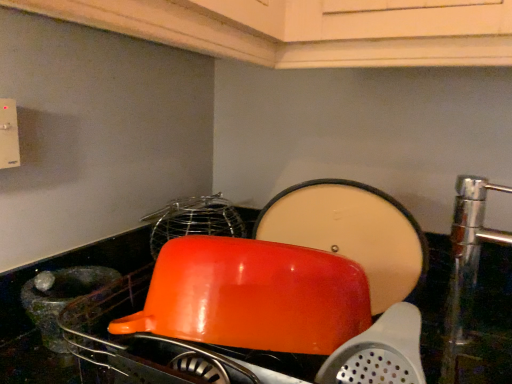
This screenshot has height=384, width=512. What do you see at coordinates (33, 325) in the screenshot? I see `glossy plastic bowl at center` at bounding box center [33, 325].

At what (x,y) coordinates should I click in order to perform the action: click on glossy orange bowl at center. Please return your answer as a coordinate pair (x, y). The height and width of the screenshot is (384, 512). Looking at the image, I should click on (252, 296).

From a real-world perspective, is glossy orange bowl at center on glossy plastic bowl at center?

Yes, from a real-world perspective, glossy orange bowl at center is over glossy plastic bowl at center

Considering the sizes of glossy orange bowl at center and glossy plastic bowl at center in the image, is glossy orange bowl at center wider or thinner than glossy plastic bowl at center?

In the image, glossy orange bowl at center appears to be more narrow than glossy plastic bowl at center.

In the scene shown: Would you consider glossy orange bowl at center to be distant from glossy plastic bowl at center?

Answer: They are positioned close to each other.

Where is `counter top located on the right of glossy orange bowl at center`? The width and height of the screenshot is (512, 384). counter top located on the right of glossy orange bowl at center is located at coordinates (33, 325).

Is translucent glass mortar at left aimed at glossy orange bowl at center?

Yes, translucent glass mortar at left is facing glossy orange bowl at center.

Considering the relative sizes of translucent glass mortar at left and glossy orange bowl at center in the image provided, is translucent glass mortar at left smaller than glossy orange bowl at center?

Yes, translucent glass mortar at left is smaller than glossy orange bowl at center.

Does translucent glass mortar at left have a greater height compared to glossy orange bowl at center?

No.

Does point (46, 292) appear closer or farther from the camera than point (237, 251)?

Point (46, 292) is positioned farther from the camera compared to point (237, 251).

Is translucent glass mortar at left smaller than glossy plastic bowl at center?

Yes, translucent glass mortar at left is smaller than glossy plastic bowl at center.

Which is more distant, (58, 270) or (62, 379)?

The point (58, 270) is behind.

From a real-world perspective, between translucent glass mortar at left and glossy plastic bowl at center, who is vertically higher?

glossy plastic bowl at center, from a real-world perspective.

From the picture: Does glossy plastic bowl at center have a lesser width compared to translucent glass mortar at left?

No.

Who is smaller, glossy plastic bowl at center or translucent glass mortar at left?

translucent glass mortar at left is smaller.

Is glossy plastic bowl at center to the right of translucent glass mortar at left from the viewer's perspective?

Yes, glossy plastic bowl at center is to the right of translucent glass mortar at left.

In the image, there is a glossy plastic bowl at center. Where is `appliance below it (from the image's perspective)`? This screenshot has width=512, height=384. appliance below it (from the image's perspective) is located at coordinates (60, 297).

Looking at this image, is glossy orange bowl at center thinner than translucent glass mortar at left?

In fact, glossy orange bowl at center might be wider than translucent glass mortar at left.

Considering the relative sizes of glossy orange bowl at center and translucent glass mortar at left in the image provided, is glossy orange bowl at center smaller than translucent glass mortar at left?

No, glossy orange bowl at center is not smaller than translucent glass mortar at left.

Which object is positioned more to the right, glossy orange bowl at center or translucent glass mortar at left?

Positioned to the right is glossy orange bowl at center.

Considering the relative sizes of glossy plastic bowl at center and glossy orange bowl at center in the image provided, is glossy plastic bowl at center wider than glossy orange bowl at center?

Yes.

Is the surface of glossy plastic bowl at center in direct contact with glossy orange bowl at center?

No, glossy plastic bowl at center is not with glossy orange bowl at center.

Which point is more distant from viewer, (x=7, y=356) or (x=275, y=303)?

The point (x=7, y=356) is behind.

Is glossy plastic bowl at center not inside glossy orange bowl at center?

Yes, glossy plastic bowl at center is outside of glossy orange bowl at center.

You are a GUI agent. You are given a task and a screenshot of the screen. Output one action in this format:
    pyautogui.click(x=<x>, y=<y>)
    Task: Click on the counter top on the right of the glossy orange bowl at center
    
    Given the screenshot: What is the action you would take?
    pyautogui.click(x=33, y=325)

Where is `appliance below the glossy orange bowl at center (from a real-world perspective)`? The image size is (512, 384). appliance below the glossy orange bowl at center (from a real-world perspective) is located at coordinates (60, 297).

Considering their positions, is glossy orange bowl at center positioned closer to glossy plastic bowl at center than translucent glass mortar at left?

Among the two, translucent glass mortar at left is located nearer to glossy plastic bowl at center.

Looking at the image, which one is located closer to glossy orange bowl at center, glossy plastic bowl at center or translucent glass mortar at left?

translucent glass mortar at left is closer to glossy orange bowl at center.

Which object lies nearer to the anchor point glossy plastic bowl at center, translucent glass mortar at left or glossy orange bowl at center?

Among the two, translucent glass mortar at left is located nearer to glossy plastic bowl at center.

When comparing their distances from translucent glass mortar at left, does glossy plastic bowl at center or glossy orange bowl at center seem further?

glossy orange bowl at center is positioned further to the anchor translucent glass mortar at left.

When comparing their distances from glossy orange bowl at center, does translucent glass mortar at left or glossy plastic bowl at center seem further?

glossy plastic bowl at center is positioned further to the anchor glossy orange bowl at center.

Looking at the image, which one is located closer to translucent glass mortar at left, glossy orange bowl at center or glossy plastic bowl at center?

glossy plastic bowl at center is closer to translucent glass mortar at left.

Locate an element on the screen. kitchen appliance between translucent glass mortar at left and glossy plastic bowl at center is located at coordinates (252, 296).